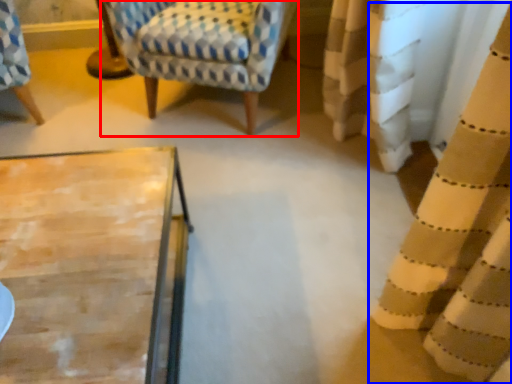
Question: Among these objects, which one is nearest to the camera, rocking chair (highlighted by a red box) or curtain (highlighted by a blue box)?

Choices:
 (A) rocking chair
 (B) curtain

Answer: (B)